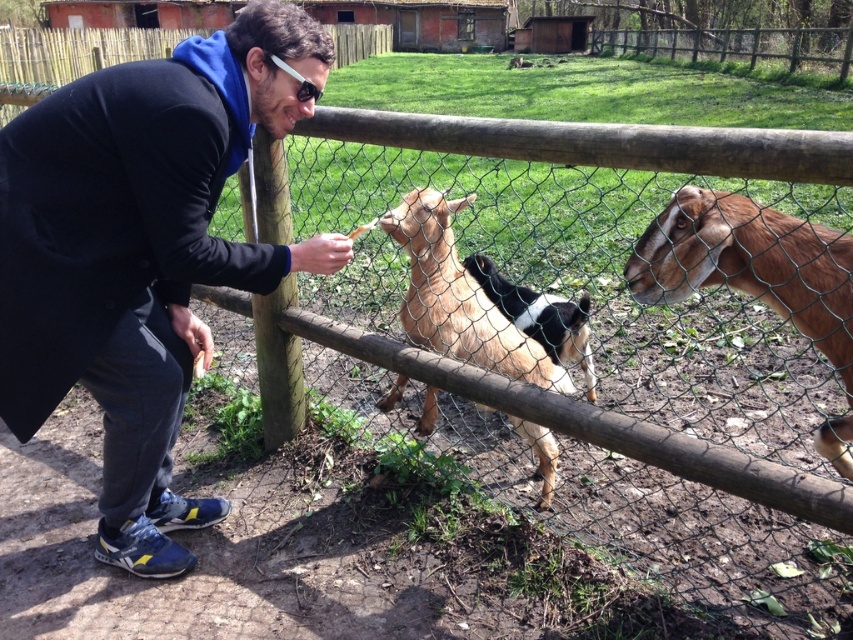
You are a visitor at the farm and want to feed the black and white fur goat at center. The wooden fence at upper center is in your way. Can you reach the goat by moving around the fence?

The black and white fur goat at center is behind the wooden fence at upper center, so you cannot reach it directly. You need to find another way, like approaching through an open gate or asking a staff member for assistance.

Based on the scene described, can you determine if the wooden fence at upper center is wider than the black and white fur goat at center?

Yes, the wooden fence at upper center is wider than the black and white fur goat at center according to the description.

You are a farmer who needs to throw a treat to the brown furry goat at center from where you are standing behind the wooden fence at upper center. What is the minimum distance you need to throw the treat?

The minimum distance you need to throw the treat to reach the brown furry goat at center from the wooden fence at upper center is 21.35 meters.